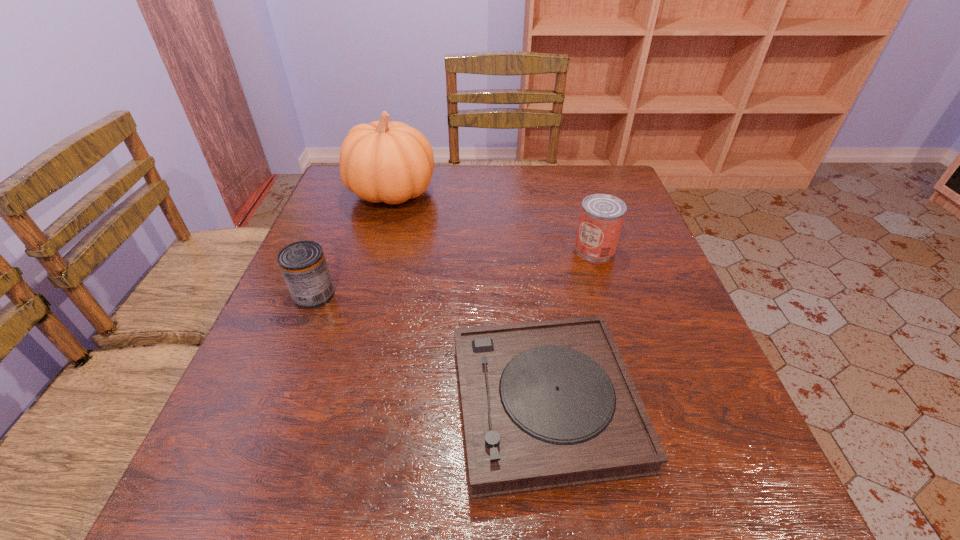
Identify the location of the tallest object. (x=392, y=162).

You are a GUI agent. You are given a task and a screenshot of the screen. Output one action in this format:
    pyautogui.click(x=<x>, y=<y>)
    Task: Click on the pumpkin
    This screenshot has height=540, width=960.
    Given the screenshot: What is the action you would take?
    pyautogui.click(x=392, y=162)

Identify the location of the right can. The image size is (960, 540). (601, 219).

Locate an element on the screen. This screenshot has height=540, width=960. the farther can is located at coordinates (601, 219).

You are a GUI agent. You are given a task and a screenshot of the screen. Output one action in this format:
    pyautogui.click(x=<x>, y=<y>)
    Task: Click on the third farthest object
    
    Given the screenshot: What is the action you would take?
    pyautogui.click(x=303, y=265)

In order to click on the nearer can in this screenshot , I will do `click(303, 265)`.

Locate an element on the screen. The image size is (960, 540). phonograph record is located at coordinates (550, 404).

I want to click on the shortest object, so click(550, 404).

The image size is (960, 540). What are the coordinates of `free location located 0.250m on the right of the farthest object` in the screenshot? It's located at (523, 193).

Locate an element on the screen. Image resolution: width=960 pixels, height=540 pixels. free space located 0.100m on the right of the farther can is located at coordinates (657, 248).